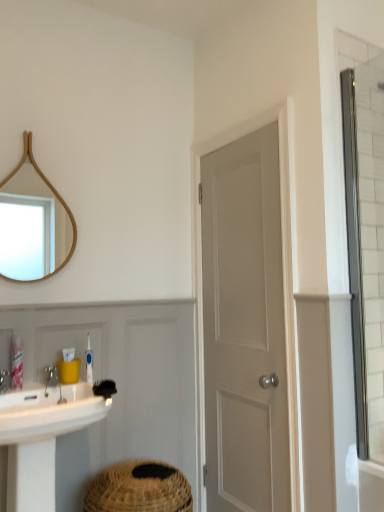
Question: Is wooden mirror at upper left in front of or behind black bristle brush at lower center in the image?

Choices:
 (A) behind
 (B) front

Answer: (A)

Question: From a real-world perspective, is wooden mirror at upper left positioned above or below black bristle brush at lower center?

Choices:
 (A) above
 (B) below

Answer: (A)

Question: Which object is positioned farthest from the black bristle brush at lower center?

Choices:
 (A) wooden mirror at upper left
 (B) silver metallic faucet at lower left
 (C) white glossy sink at lower left
 (D) yellow plastic container at sink, the 2th toiletry from the left
 (E) white matte door at center

Answer: (E)

Question: Considering the real-world distances, which object is farthest from the silver metallic faucet at lower left?

Choices:
 (A) wooden mirror at upper left
 (B) blue plastic toothbrush at lower left, acting as the third toiletry starting from the left
 (C) white matte door at center
 (D) pink plastic tube at lower left, positioned as the third toiletry in right-to-left order
 (E) clear glass shower door at right

Answer: (E)